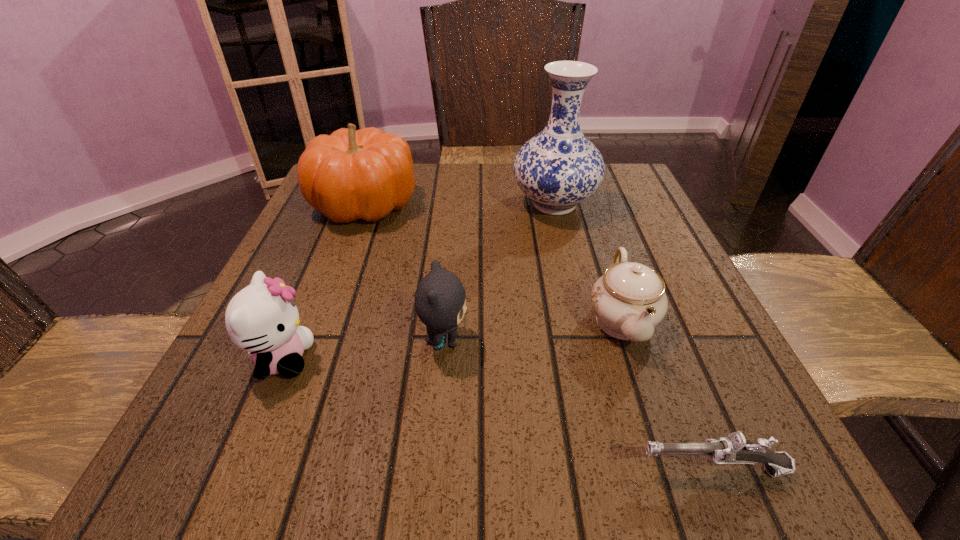
Identify the location of vacant space that's between the fourth object from right to left and the vase. (499, 272).

Where is `the fifth closest object to the chinaware`? This screenshot has height=540, width=960. the fifth closest object to the chinaware is located at coordinates (262, 318).

Where is `the closest object relative to the left kitten`? Image resolution: width=960 pixels, height=540 pixels. the closest object relative to the left kitten is located at coordinates (440, 300).

Locate an element on the screen. This screenshot has width=960, height=540. vacant space that satisfies the following two spatial constraints: 1. at the spout of the chinaware; 2. on the front-facing side of the left kitten is located at coordinates (635, 359).

This screenshot has height=540, width=960. In order to click on vacant space that satisfies the following two spatial constraints: 1. on the front side of the vase; 2. on the front-facing side of the third object from left to right in this screenshot , I will do `click(587, 341)`.

Find the location of `free spot that satisfies the following two spatial constraints: 1. at the spout of the chinaware; 2. on the front-facing side of the left kitten`. free spot that satisfies the following two spatial constraints: 1. at the spout of the chinaware; 2. on the front-facing side of the left kitten is located at coordinates (635, 359).